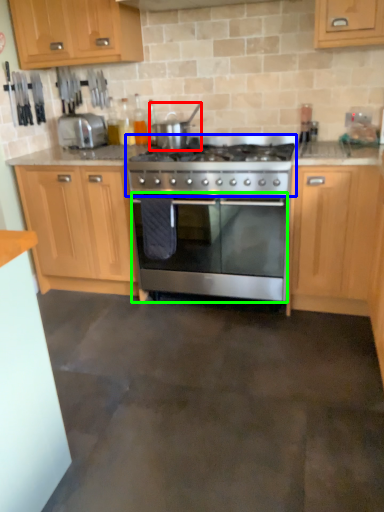
Question: Which object is positioned farthest from appliance (highlighted by a red box)? Select from gas stove (highlighted by a blue box) and oven (highlighted by a green box).

Choices:
 (A) gas stove
 (B) oven

Answer: (B)